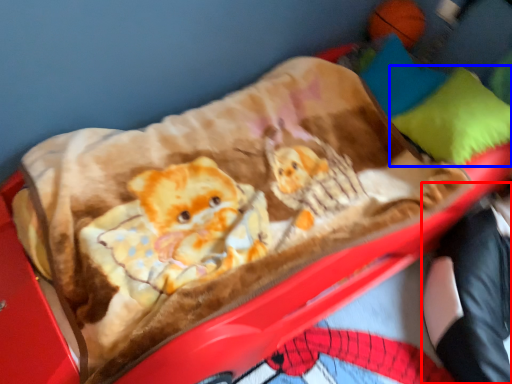
Question: Among these objects, which one is farthest to the camera, couple (highlighted by a red box) or pillow (highlighted by a blue box)?

Choices:
 (A) couple
 (B) pillow

Answer: (B)